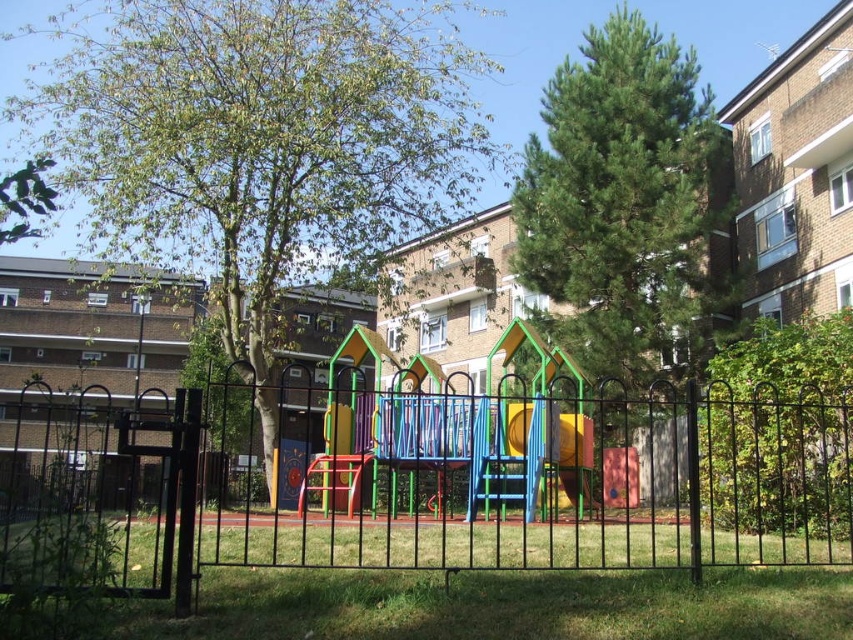
Question: Which is farther from the black metal fence at center?

Choices:
 (A) green leafy tree at center
 (B) multicolored plastic slide at center

Answer: (B)

Question: Among these points, which one is nearest to the camera?

Choices:
 (A) (482, 484)
 (B) (627, 257)
 (C) (521, 416)
 (D) (178, 99)

Answer: (C)

Question: Which object is farther from the camera taking this photo?

Choices:
 (A) green leafy tree at center
 (B) multicolored plastic slide at center
 (C) green textured pine tree at upper right

Answer: (C)

Question: Does black metal fence at center have a larger size compared to green textured pine tree at upper right?

Choices:
 (A) no
 (B) yes

Answer: (B)

Question: Does black metal fence at center appear under green leafy tree at center?

Choices:
 (A) yes
 (B) no

Answer: (A)

Question: Is green textured pine tree at upper right to the right of multicolored plastic slide at center from the viewer's perspective?

Choices:
 (A) yes
 (B) no

Answer: (A)